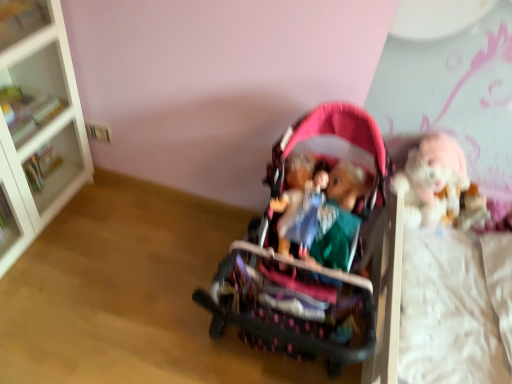
Question: Looking at the image, does white glossy cabinet at upper left seem bigger or smaller compared to fluffy white doll at right?

Choices:
 (A) big
 (B) small

Answer: (B)

Question: From a real-world perspective, is white glossy cabinet at upper left positioned above or below fluffy white doll at right?

Choices:
 (A) below
 (B) above

Answer: (A)

Question: Estimate the real-world distances between objects in this image. Which object is closer to the fluffy white doll at right?

Choices:
 (A) white glossy cabinet at upper left
 (B) pink fabric stroller at center
 (C) matte plastic doll at center
 (D) white glass bookcase at left

Answer: (C)

Question: Which object is the closest to the pink fabric stroller at center?

Choices:
 (A) white glossy cabinet at upper left
 (B) fluffy white doll at right
 (C) white glass bookcase at left
 (D) matte plastic doll at center

Answer: (D)